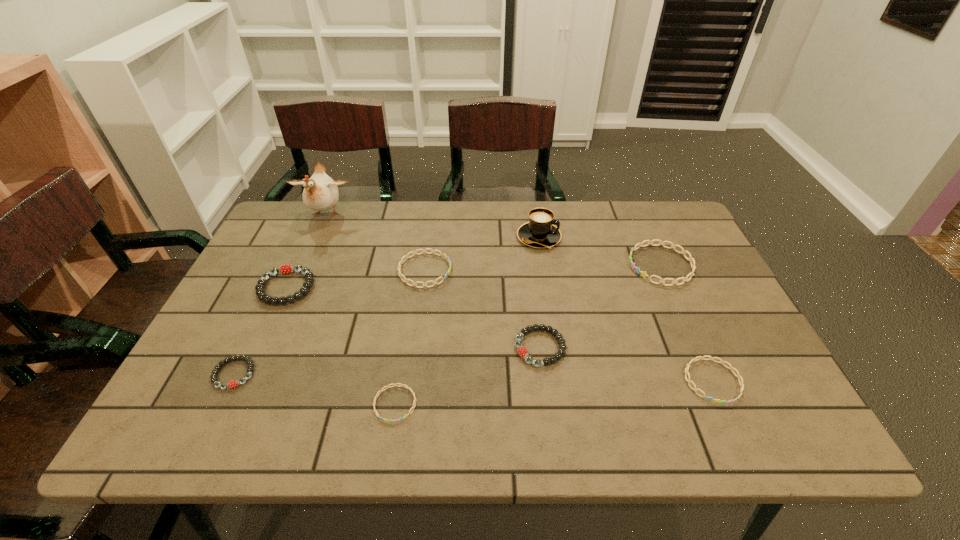
The image size is (960, 540). What are the coordinates of `free spot between the second biggest blue bracelet and the third bracelet from right to left` in the screenshot? It's located at (482, 309).

This screenshot has height=540, width=960. Find the location of `empty location between the farthest black bracelet and the bird`. empty location between the farthest black bracelet and the bird is located at coordinates (306, 251).

The image size is (960, 540). I want to click on free spot between the black cappuccino and the bird, so click(x=432, y=226).

Image resolution: width=960 pixels, height=540 pixels. Find the location of `free spot between the second biggest blue bracelet and the bird`. free spot between the second biggest blue bracelet and the bird is located at coordinates (375, 242).

Find the location of a particular element. This screenshot has width=960, height=540. empty location between the smallest blue bracelet and the smallest black bracelet is located at coordinates tap(315, 389).

This screenshot has width=960, height=540. I want to click on vacant area that lies between the farthest black bracelet and the biggest blue bracelet, so click(x=473, y=276).

Locate an element on the screen. the fourth closest object to the third biggest blue bracelet is located at coordinates (x=401, y=262).

Select which object is the fifth closest to the smallest black bracelet. Please provide its 2D coordinates. Your answer should be formatted as a tuple, i.e. [(x, y)], where the tuple contains the x and y coordinates of a point satisfying the conditions above.

[(522, 351)]

Identify the location of bracelet identified as the second closest to the biggest blue bracelet. (x=522, y=351).

Locate an element on the screen. The height and width of the screenshot is (540, 960). the second closest bracelet to the second biggest blue bracelet is located at coordinates (288, 269).